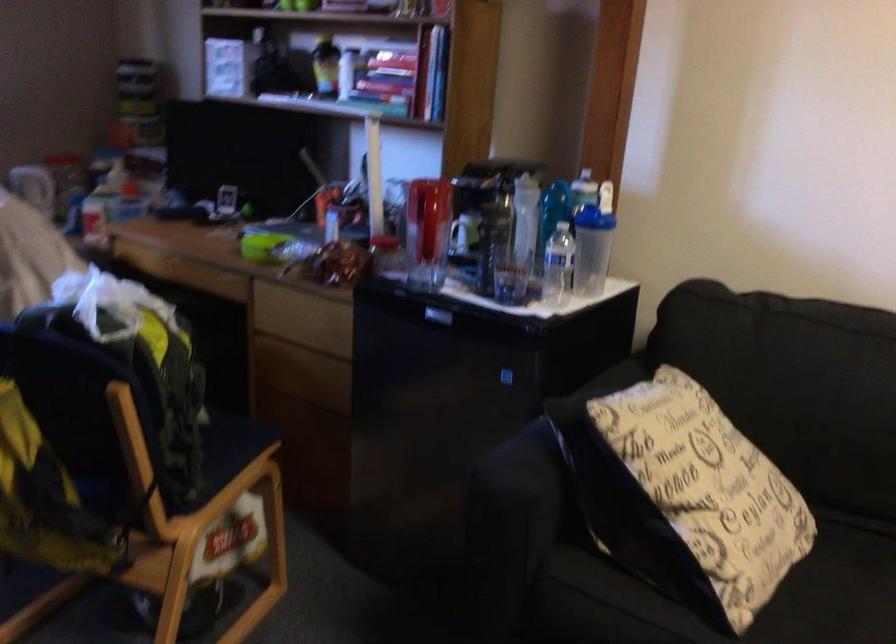
Locate an element on the screen. This screenshot has height=644, width=896. patterned throw pillow is located at coordinates (694, 496).